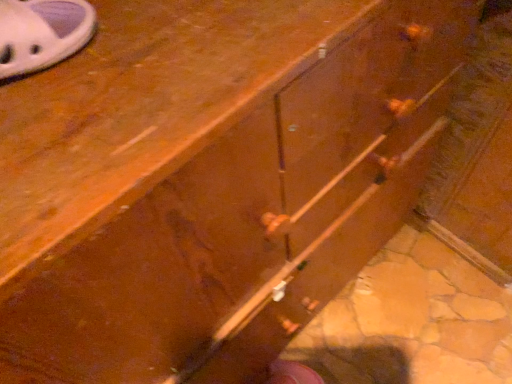
Measure the distance between point [65,43] and camera.

The distance of point [65,43] from camera is 15.98 inches.

The width and height of the screenshot is (512, 384). Describe the element at coordinates (42, 33) in the screenshot. I see `white fabric shoe at upper left` at that location.

Find the location of a particular element. This screenshot has width=512, height=384. white fabric shoe at upper left is located at coordinates (42, 33).

This screenshot has height=384, width=512. What are the coordinates of `white fabric shoe at upper left` in the screenshot? It's located at click(42, 33).